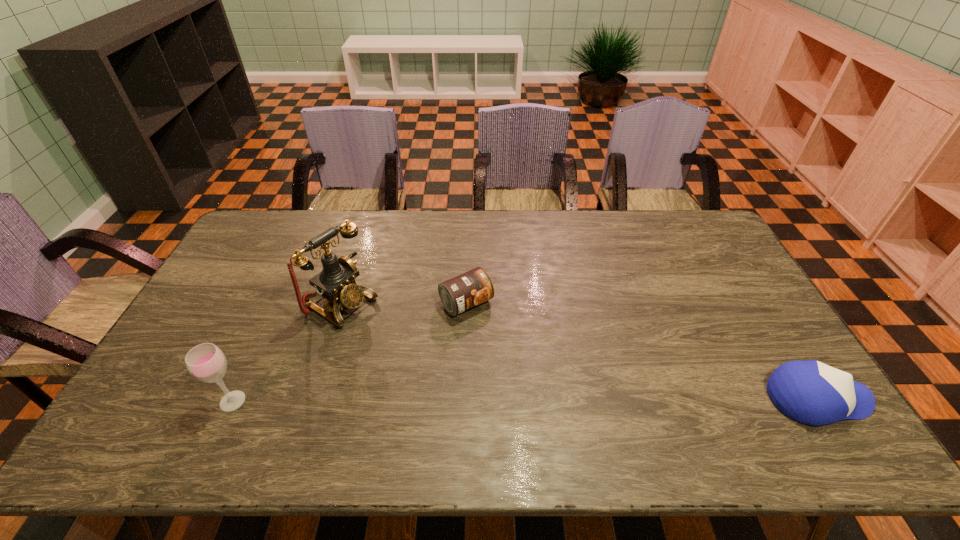
This screenshot has width=960, height=540. Find the location of `free space between the third shortest object and the third object from right to left`. free space between the third shortest object and the third object from right to left is located at coordinates (287, 352).

Find the location of a particular element. The width and height of the screenshot is (960, 540). free area in between the third object from left to right and the wineglass is located at coordinates (349, 352).

This screenshot has width=960, height=540. Find the location of `vacant space that is in between the can and the baseball cap`. vacant space that is in between the can and the baseball cap is located at coordinates (642, 351).

What are the coordinates of `free space between the third object from left to right and the leftmost object` in the screenshot? It's located at (349, 352).

At what (x,y) coordinates should I click in order to perform the action: click on free spot between the leftmost object and the can. Please return your answer as a coordinate pair (x, y). The width and height of the screenshot is (960, 540). Looking at the image, I should click on (349, 352).

Locate an element on the screen. This screenshot has width=960, height=540. vacant region between the third shortest object and the second object from left to right is located at coordinates (287, 352).

Where is `empty location between the third shortest object and the second object from right to left`? empty location between the third shortest object and the second object from right to left is located at coordinates (349, 352).

Identify the location of free space between the baseball cap and the can. (642, 351).

The image size is (960, 540). I want to click on vacant area that lies between the third object from right to left and the third object from left to right, so click(x=404, y=303).

Locate an element on the screen. The width and height of the screenshot is (960, 540). free space that is in between the tallest object and the second tallest object is located at coordinates (287, 352).